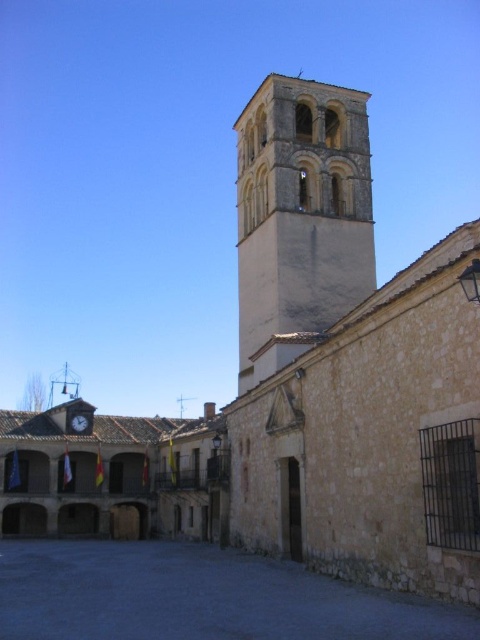
Question: Can you confirm if white stone tower at center is positioned to the right of metallic clock at center?

Choices:
 (A) no
 (B) yes

Answer: (B)

Question: Estimate the real-world distances between objects in this image. Which object is closer to the dark stone alley at lower left?

Choices:
 (A) white stone tower at center
 (B) metallic clock at center

Answer: (A)

Question: Among these objects, which one is nearest to the camera?

Choices:
 (A) dark stone alley at lower left
 (B) white stone tower at center

Answer: (A)

Question: Which of these objects is positioned closest to the dark stone alley at lower left?

Choices:
 (A) white stone tower at center
 (B) metallic clock at center

Answer: (A)

Question: Does white stone tower at center have a greater width compared to metallic clock at center?

Choices:
 (A) no
 (B) yes

Answer: (B)

Question: Does dark stone alley at lower left have a larger size compared to metallic clock at center?

Choices:
 (A) yes
 (B) no

Answer: (A)